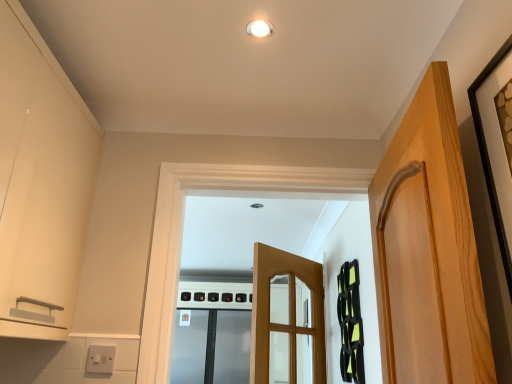
Question: Does white glossy light fixture at upper center have a lesser height compared to matte white cabinet at left?

Choices:
 (A) yes
 (B) no

Answer: (A)

Question: Is the depth of white glossy light fixture at upper center less than that of matte white cabinet at left?

Choices:
 (A) no
 (B) yes

Answer: (A)

Question: From the image's perspective, is white glossy light fixture at upper center on matte white cabinet at left?

Choices:
 (A) yes
 (B) no

Answer: (A)

Question: Considering the relative positions of white glossy light fixture at upper center and matte white cabinet at left in the image provided, is white glossy light fixture at upper center to the left of matte white cabinet at left from the viewer's perspective?

Choices:
 (A) no
 (B) yes

Answer: (A)

Question: Can you confirm if white glossy light fixture at upper center is thinner than matte white cabinet at left?

Choices:
 (A) no
 (B) yes

Answer: (B)

Question: From a real-world perspective, is white glossy light fixture at upper center over matte white cabinet at left?

Choices:
 (A) no
 (B) yes

Answer: (B)

Question: Is black matte picture frame at upper right in front of stainless steel refrigerator at center?

Choices:
 (A) no
 (B) yes

Answer: (B)

Question: Is black matte picture frame at upper right further to camera compared to stainless steel refrigerator at center?

Choices:
 (A) yes
 (B) no

Answer: (B)

Question: Does black matte picture frame at upper right have a smaller size compared to stainless steel refrigerator at center?

Choices:
 (A) yes
 (B) no

Answer: (A)

Question: From a real-world perspective, does black matte picture frame at upper right stand above stainless steel refrigerator at center?

Choices:
 (A) no
 (B) yes

Answer: (B)

Question: From the image's perspective, would you say black matte picture frame at upper right is shown under stainless steel refrigerator at center?

Choices:
 (A) yes
 (B) no

Answer: (B)

Question: From a real-world perspective, is black matte picture frame at upper right located beneath stainless steel refrigerator at center?

Choices:
 (A) yes
 (B) no

Answer: (B)

Question: Is white glossy light fixture at upper center smaller than stainless steel refrigerator at center?

Choices:
 (A) no
 (B) yes

Answer: (B)